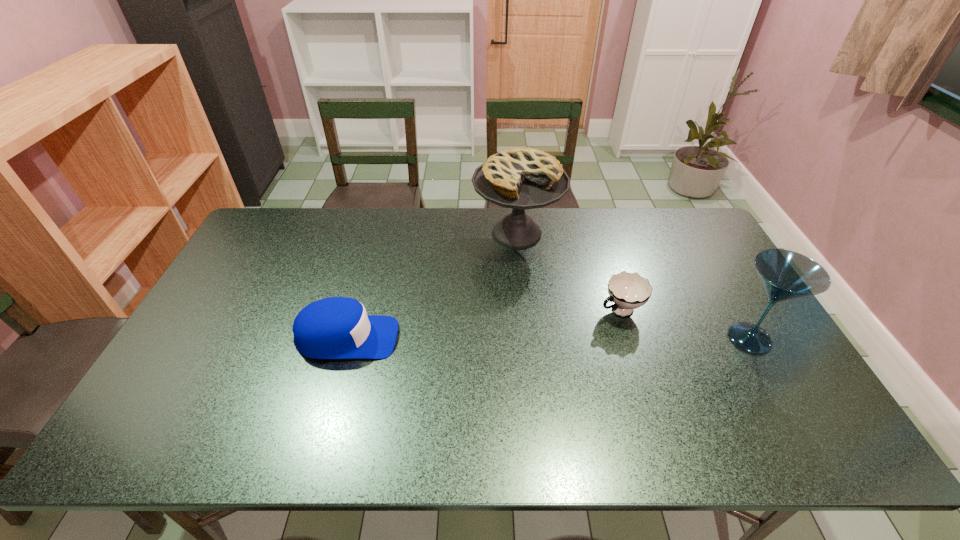
I want to click on unoccupied position between the baseball cap and the pie, so click(432, 286).

Image resolution: width=960 pixels, height=540 pixels. In order to click on object that is the second closest to the cup in this screenshot , I will do `click(786, 275)`.

Locate which object ranks in proximity to the cup. Please provide its 2D coordinates. Your answer should be formatted as a tuple, i.e. [(x, y)], where the tuple contains the x and y coordinates of a point satisfying the conditions above.

[(523, 178)]

This screenshot has width=960, height=540. I want to click on vacant region that satisfies the following two spatial constraints: 1. on the front side of the martini; 2. on the left side of the third object from right to left, so click(527, 339).

Identify the location of vacant area that satisfies the following two spatial constraints: 1. on the front side of the rightmost object; 2. on the left side of the second object from right to left. (629, 339).

Where is `vacant region that satisfies the following two spatial constraints: 1. on the front side of the martini; 2. on the left side of the second object from right to left`? vacant region that satisfies the following two spatial constraints: 1. on the front side of the martini; 2. on the left side of the second object from right to left is located at coordinates (629, 339).

The height and width of the screenshot is (540, 960). Identify the location of free space that satisfies the following two spatial constraints: 1. on the front side of the rightmost object; 2. on the left side of the second object from right to left. point(629,339).